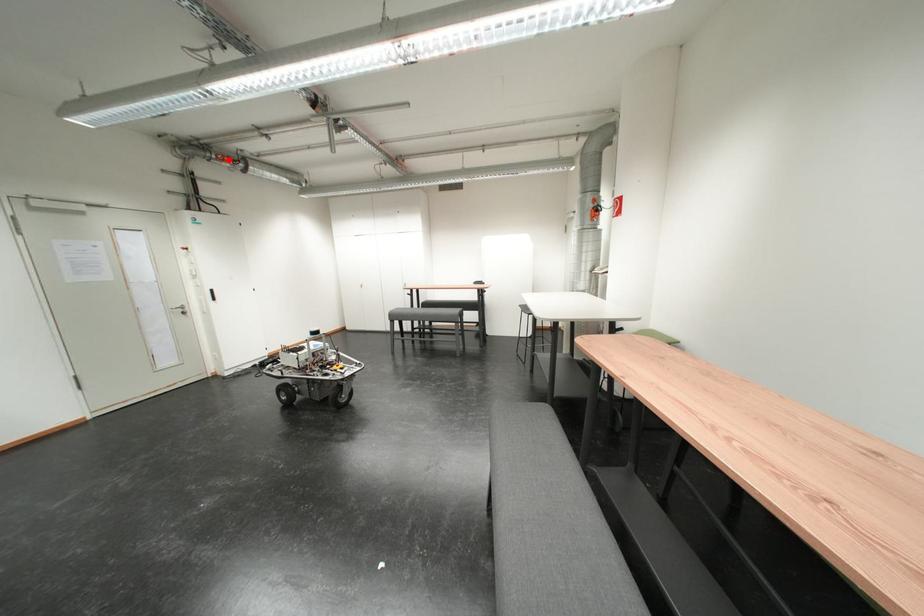
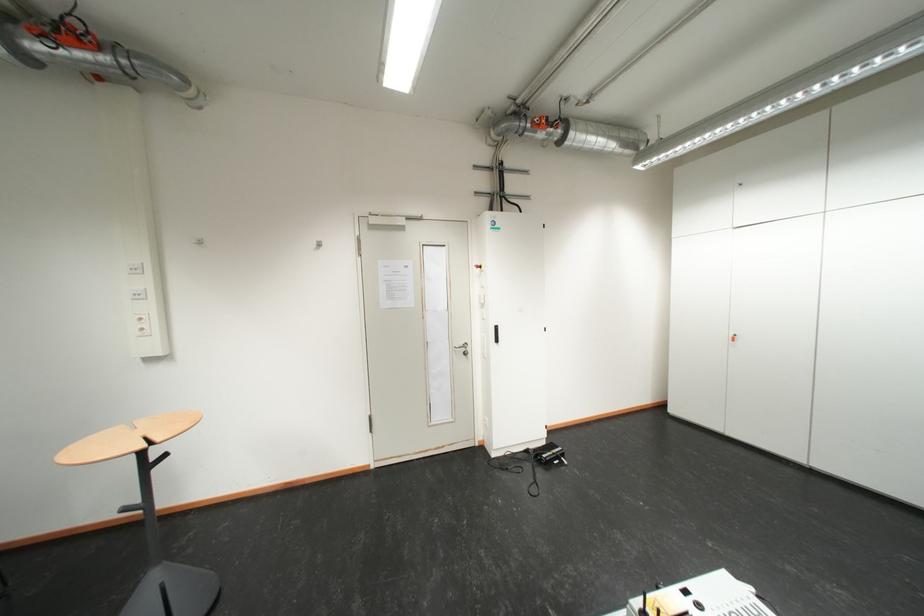
Locate, in the second image, the point that corresponds to the highlighted location in the first image.

(543, 126)